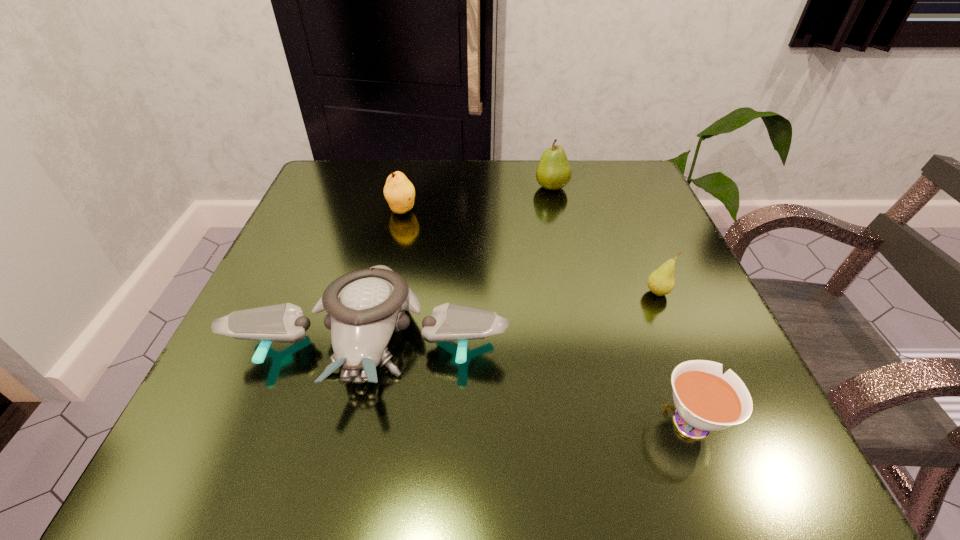
Find the location of a particular element. the second pear from left to right is located at coordinates (553, 172).

Find the location of a particular element. The width and height of the screenshot is (960, 540). the tallest object is located at coordinates click(x=553, y=172).

Locate an element on the screen. the leftmost pear is located at coordinates (399, 192).

This screenshot has height=540, width=960. I want to click on the second nearest pear, so click(399, 192).

The width and height of the screenshot is (960, 540). Find the location of `the nearest pear`. the nearest pear is located at coordinates (661, 281).

Where is `drone`? This screenshot has width=960, height=540. drone is located at coordinates (365, 307).

This screenshot has height=540, width=960. I want to click on teacup, so click(705, 400).

I want to click on free space located on the front of the tallest object, so pyautogui.click(x=570, y=268).

Identify the location of vacant region located 0.080m on the front of the second farthest pear. Image resolution: width=960 pixels, height=540 pixels. (395, 243).

Find the location of a particular element. free spot located on the left of the rightmost pear is located at coordinates (x=587, y=293).